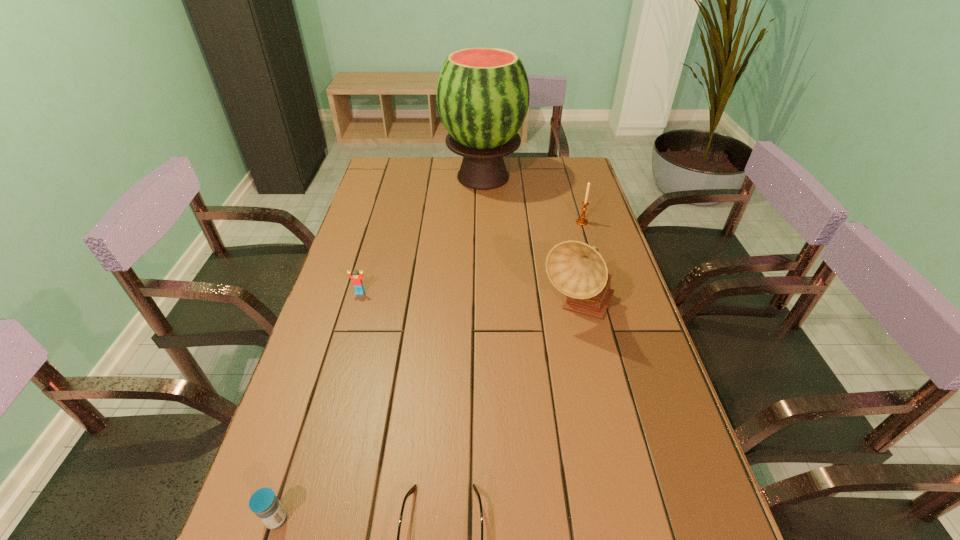
Locate an element on the screen. vacant area situated 0.130m on the back of the medicine is located at coordinates (301, 441).

At what (x,y) coordinates should I click in order to perform the action: click on free region located 0.170m on the face of the Lego. Please return your answer as a coordinate pair (x, y). This screenshot has height=540, width=960. Looking at the image, I should click on (346, 342).

Locate an element on the screen. object that is at the far edge is located at coordinates (483, 94).

Image resolution: width=960 pixels, height=540 pixels. I want to click on medicine positioned at the left edge, so click(264, 503).

At what (x,y) coordinates should I click in order to perform the action: click on Lego that is at the left edge. Please return your answer as a coordinate pair (x, y). Image resolution: width=960 pixels, height=540 pixels. Looking at the image, I should click on (357, 279).

What are the coordinates of `phonograph record at the right edge` in the screenshot? It's located at (576, 269).

Find the location of a particular element. This screenshot has width=960, height=540. candle_holder located in the right edge section of the desktop is located at coordinates 581,221.

You are a GUI agent. You are given a task and a screenshot of the screen. Output one action in this format:
    pyautogui.click(x=<x>, y=<y>)
    Task: Click on the vacant region at the far edge of the desktop
    
    Given the screenshot: What is the action you would take?
    pyautogui.click(x=463, y=158)

In the image, there is a desktop. Identify the location of vacant space at the left edge. This screenshot has width=960, height=540. (320, 408).

Where is `blank area at the right edge`? The height and width of the screenshot is (540, 960). blank area at the right edge is located at coordinates (617, 273).